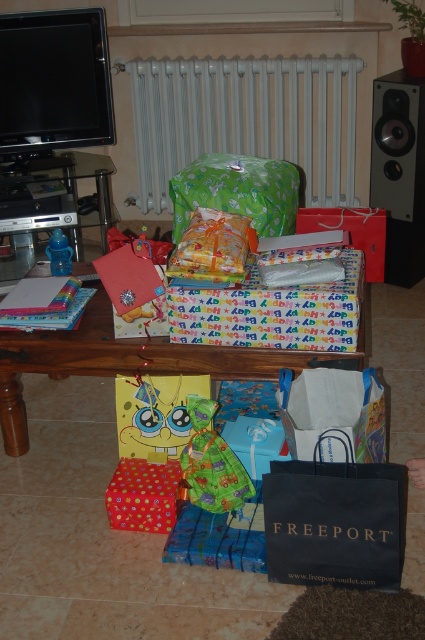
Question: Does wooden table at center have a larger size compared to polka dot paper gift at center?

Choices:
 (A) no
 (B) yes

Answer: (B)

Question: Which of the following is the closest to the observer?

Choices:
 (A) (45, 264)
 (B) (212, 445)
 (C) (414, 240)

Answer: (B)

Question: Can you confirm if colorful paper wrapped gift at center is wider than green fabric toy at center?

Choices:
 (A) yes
 (B) no

Answer: (A)

Question: Which object is positioned closest to the polka dot paper gift at center?

Choices:
 (A) black plastic speaker at upper right
 (B) green fabric toy at center
 (C) white metallic radiator at upper center
 (D) colorful paper wrapped gift at center

Answer: (B)

Question: Does black plastic speaker at upper right have a smaller size compared to polka dot paper gift at center?

Choices:
 (A) no
 (B) yes

Answer: (A)

Question: Which point is farther to the camera?

Choices:
 (A) wooden table at center
 (B) white metallic radiator at upper center

Answer: (B)